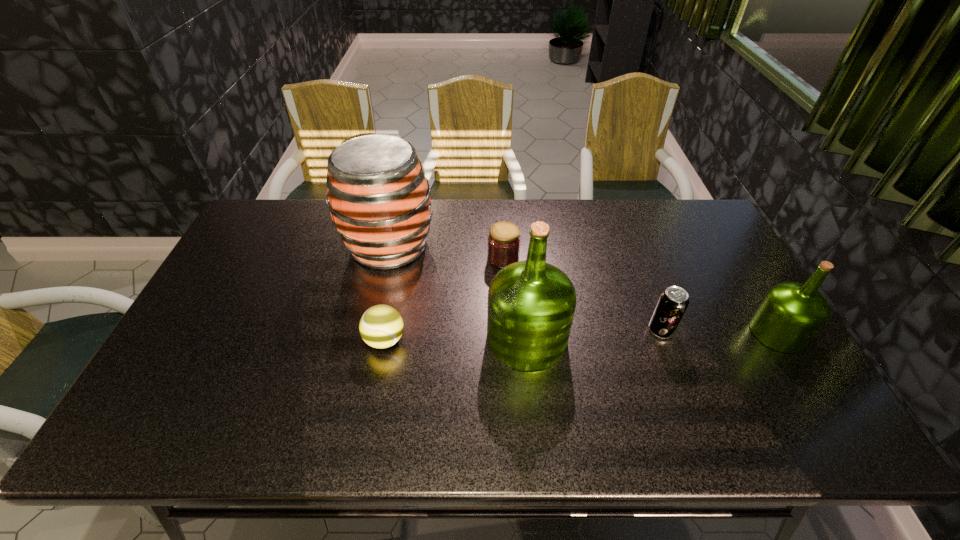
Where is `vacant space situated on the front of the cider`? Image resolution: width=960 pixels, height=540 pixels. vacant space situated on the front of the cider is located at coordinates (363, 366).

Where is `vacant region located 0.100m on the left of the jam`? vacant region located 0.100m on the left of the jam is located at coordinates (455, 258).

Locate an element on the screen. The width and height of the screenshot is (960, 540). free location located on the front of the fourth tallest object is located at coordinates (684, 391).

The height and width of the screenshot is (540, 960). In order to click on free point located on the right of the tennis ball in this screenshot , I will do `click(481, 340)`.

This screenshot has width=960, height=540. Find the location of `object located in the far edge section of the desktop`. object located in the far edge section of the desktop is located at coordinates (379, 198).

Identify the location of object that is at the near edge. The width and height of the screenshot is (960, 540). (531, 304).

Locate an element on the screen. The image size is (960, 540). object situated at the right edge is located at coordinates (791, 314).

In the image, there is a desktop. At what (x,y) coordinates should I click in order to perform the action: click on vacant space at the far edge. Please return your answer as a coordinate pair (x, y). Looking at the image, I should click on (301, 221).

Find the location of a particular element. vacant region at the near edge of the desktop is located at coordinates click(x=690, y=392).

In the image, there is a desktop. What are the coordinates of `vacant space at the left edge` in the screenshot? It's located at (x=280, y=247).